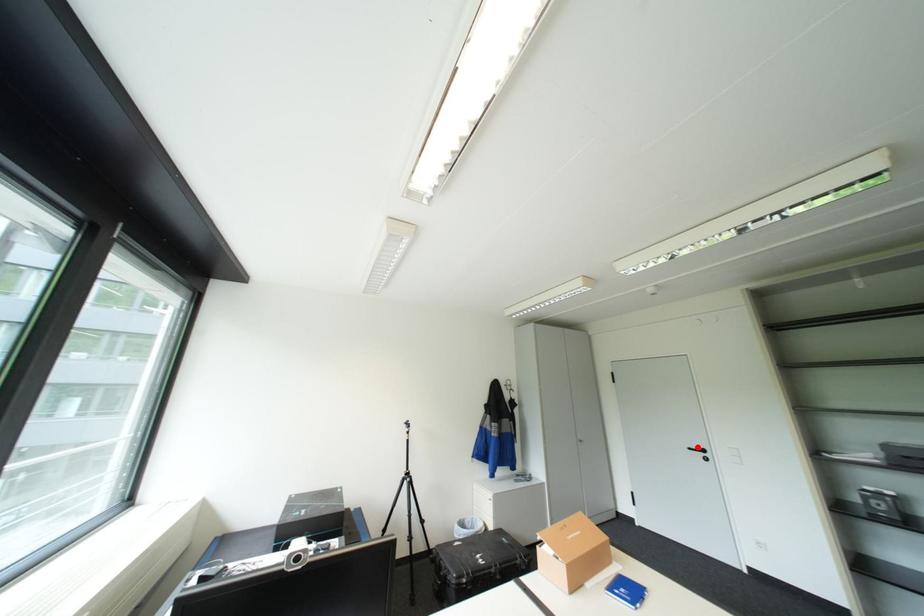
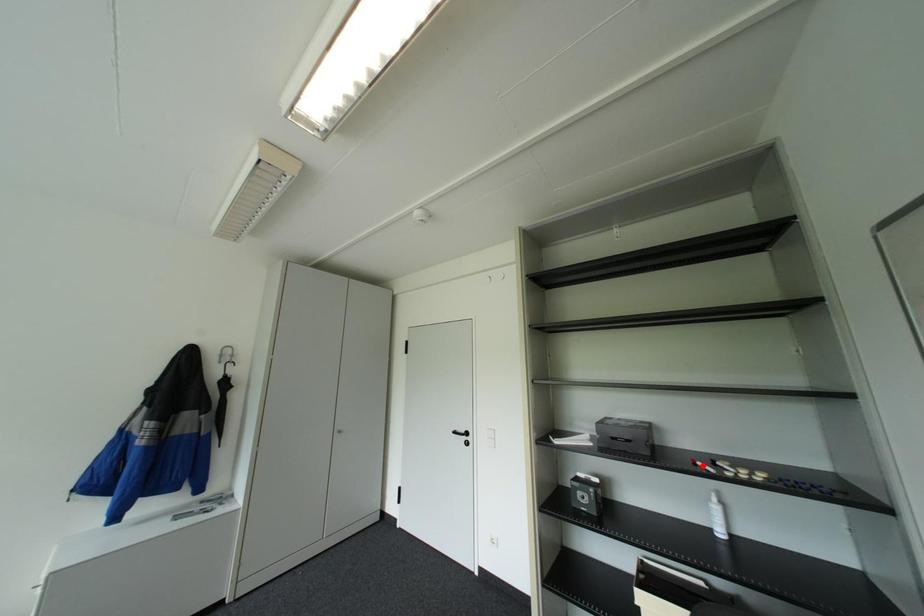
I am providing you with two images of the same scene from different viewpoints. A red point is marked on the first image and another point is marked on the second image. Does the point marked in image1 correspond to the same location as the one in image2?

No